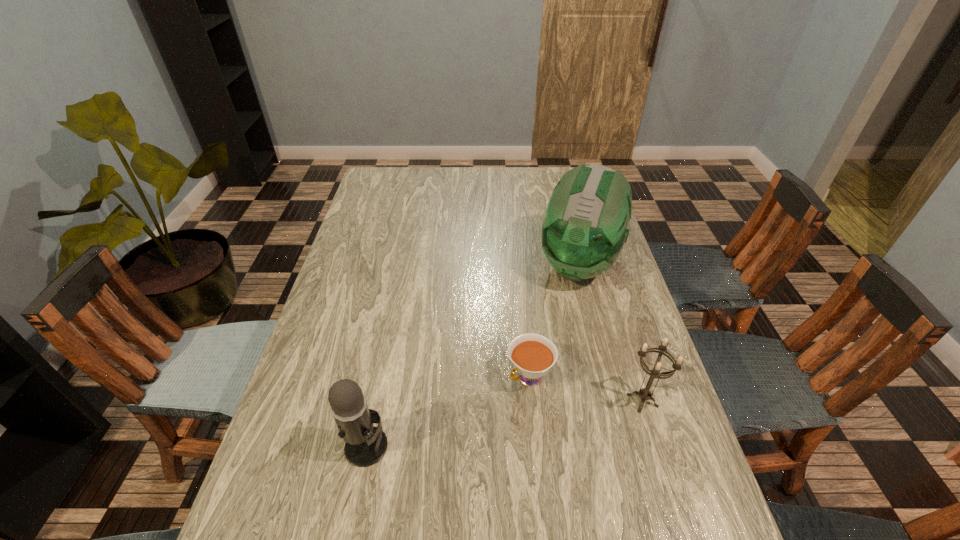
This screenshot has width=960, height=540. What are the coordinates of `free space on the desktop that is between the second tallest object and the candle holder and is positioned on the visor of the farthest object` in the screenshot? It's located at (515, 422).

Locate an element on the screen. free space on the desktop that is between the leftmost object and the third tallest object and is positioned on the side of the teacup with the handle is located at coordinates (469, 429).